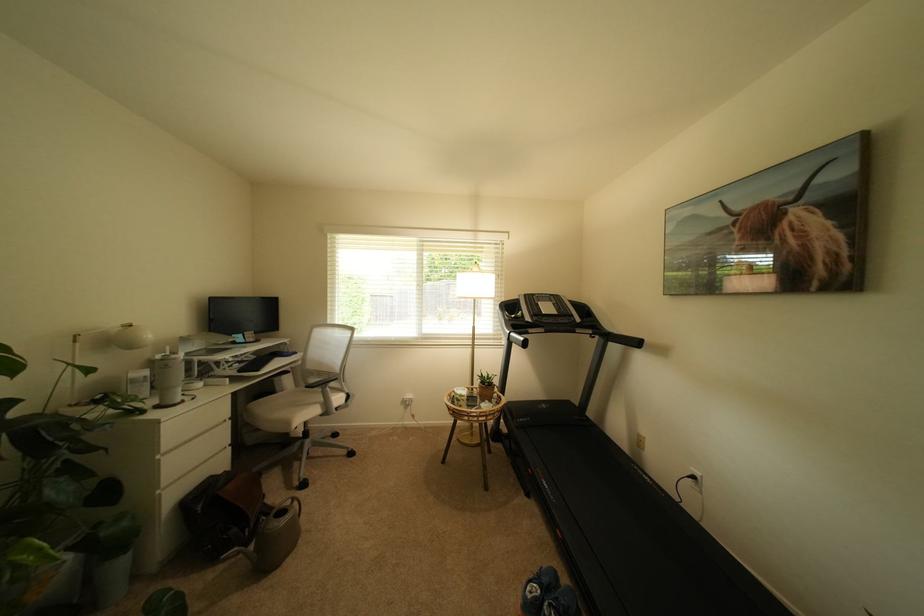
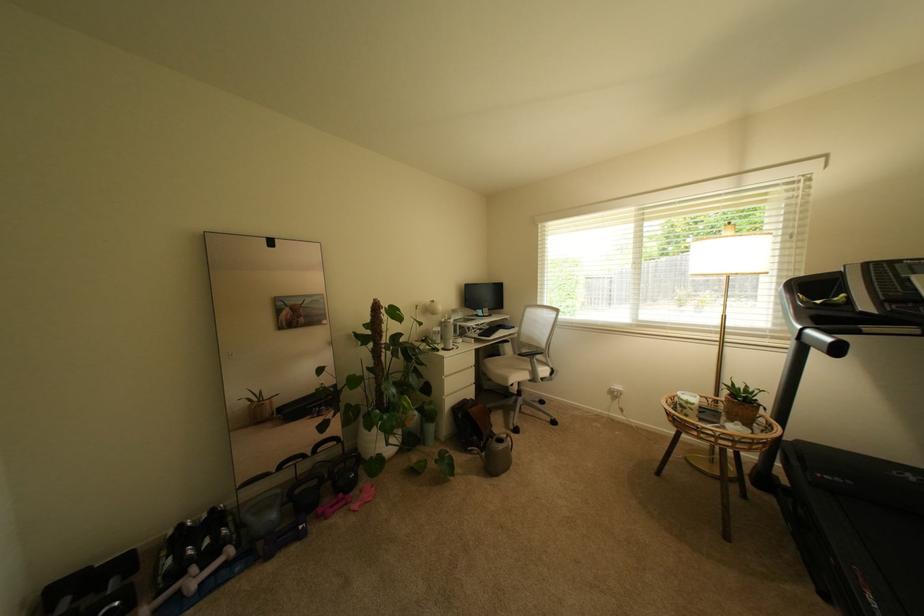
Question: I am providing you with two images of the same scene from different viewpoints. After the viewpoint changes to image2, which objects are now occluded?

Choices:
 (A) black kettlebell
 (B) gray kettlebell
 (C) pink dumbbell
 (D) none of these

Answer: (D)